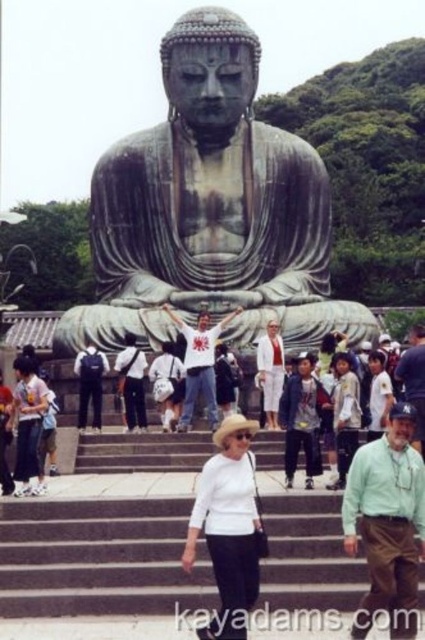
Which is in front, point (385, 472) or point (133, 374)?

Point (385, 472) is in front.

Is point (401, 417) in front of point (118, 360)?

Yes, point (401, 417) is in front of point (118, 360).

This screenshot has height=640, width=425. What do you see at coordinates (388, 522) in the screenshot? I see `green cotton shirt at center` at bounding box center [388, 522].

Find the location of a particular element. Image resolution: width=425 pixels, height=640 pixels. green cotton shirt at center is located at coordinates (388, 522).

From the picture: Is gray concrete stairs at center to the right of white matte hat at center from the viewer's perspective?

Incorrect, gray concrete stairs at center is not on the right side of white matte hat at center.

Does gray concrete stairs at center appear over white matte hat at center?

No.

This screenshot has height=640, width=425. What do you see at coordinates (99, 556) in the screenshot?
I see `gray concrete stairs at center` at bounding box center [99, 556].

You are a GUI agent. You are given a task and a screenshot of the screen. Output one action in this format:
    pyautogui.click(x=<x>, y=<y>)
    Task: Click on the gray concrete stairs at center
    
    Given the screenshot: What is the action you would take?
    pyautogui.click(x=99, y=556)

Based on the photo, is the position of gray concrete stairs at center less distant than that of green cotton shirt at center?

No, gray concrete stairs at center is further to the viewer.

Consider the image. Can you confirm if gray concrete stairs at center is positioned below green cotton shirt at center?

Correct, gray concrete stairs at center is located below green cotton shirt at center.

Locate an element on the screen. The height and width of the screenshot is (640, 425). gray concrete stairs at center is located at coordinates (99, 556).